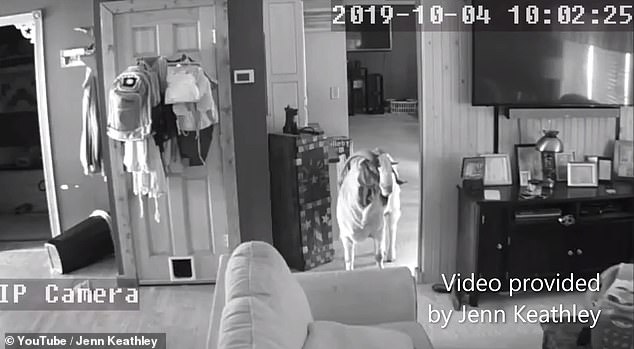
Identify the location of couch. The height and width of the screenshot is (349, 634). click(x=370, y=310).